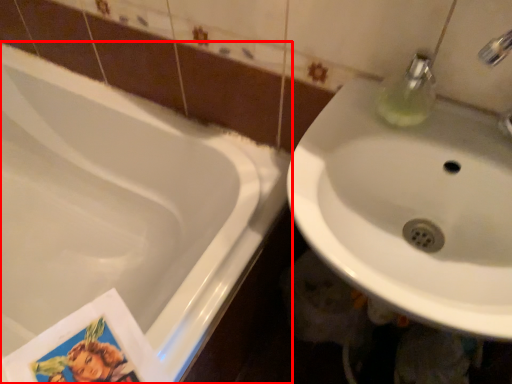
Question: From the image, what is the correct spatial relationship of bathtub (annotated by the red box) in relation to sink?

Choices:
 (A) right
 (B) left

Answer: (B)